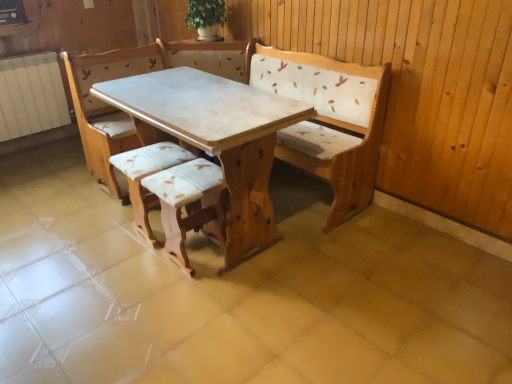
This screenshot has width=512, height=384. Identify the location of vacant area that lies in front of wooden armchair at center, the 1th armchair viewed from the right. (186, 297).